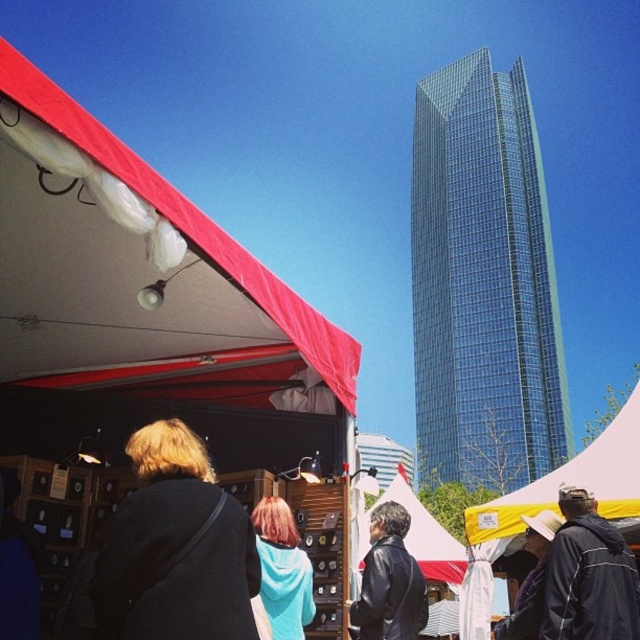
Question: Among these objects, which one is nearest to the camera?

Choices:
 (A) leather jacket at center
 (B) dark gray coat at center
 (C) white fabric canopy at upper left
 (D) teal fleece jacket at center

Answer: (C)

Question: Which point is farther to the camera?

Choices:
 (A) (632, 605)
 (B) (289, 572)

Answer: (B)

Question: Is dark gray jacket at lower right above white matte hat at lower right?

Choices:
 (A) no
 (B) yes

Answer: (B)

Question: Can you confirm if leather jacket at center is positioned to the left of teal fleece jacket at center?

Choices:
 (A) no
 (B) yes

Answer: (A)

Question: Is transparent glass skyscraper at upper center below white matte hat at lower right?

Choices:
 (A) no
 (B) yes

Answer: (A)

Question: Which object appears closest to the camera in this image?

Choices:
 (A) white fabric canopy at upper left
 (B) dark gray coat at center
 (C) white matte hat at lower right

Answer: (A)